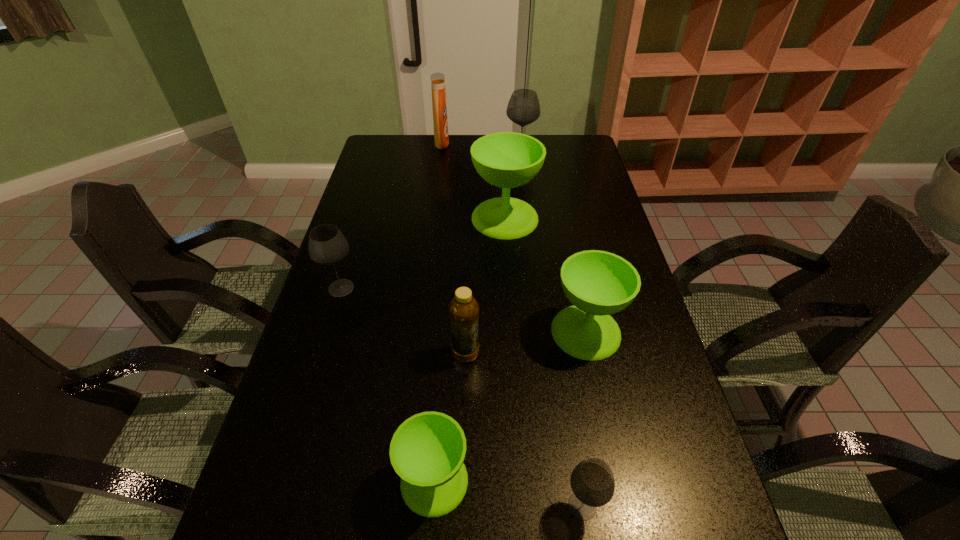
Image resolution: width=960 pixels, height=540 pixels. Find the location of `the nearest gray wineglass`. the nearest gray wineglass is located at coordinates (592, 482).

Locate an element on the screen. This screenshot has height=540, width=960. the smallest green wineglass is located at coordinates (427, 451).

Find the location of a particular element. The height and width of the screenshot is (540, 960). vacant space located on the front-facing side of the detergent is located at coordinates (461, 144).

You are a GUI agent. You are given a task and a screenshot of the screen. Output one action in this format:
    pyautogui.click(x=<x>, y=<y>)
    Task: Click on the free spot located 0.350m on the left of the farthest wineglass
    The height and width of the screenshot is (540, 960).
    Given the screenshot: What is the action you would take?
    pyautogui.click(x=418, y=156)

The height and width of the screenshot is (540, 960). In order to click on vacant position located on the left of the fifth nearest wineglass in this screenshot , I will do `click(395, 218)`.

This screenshot has width=960, height=540. Find the location of `vacant space located on the right of the bottle`. vacant space located on the right of the bottle is located at coordinates [584, 354].

At what (x,y) coordinates should I click in order to perform the action: click on vacant position located 0.370m on the front of the third nearest wineglass. Please return your answer as a coordinate pair (x, y). Image resolution: width=960 pixels, height=540 pixels. Looking at the image, I should click on (627, 526).

I want to click on blank space located 0.400m on the right of the leftmost object, so click(x=499, y=288).

The image size is (960, 540). What are the coordinates of `vacant space located on the back of the nearest gray wineglass` in the screenshot? It's located at (564, 388).

Image resolution: width=960 pixels, height=540 pixels. I want to click on vacant point located 0.400m on the back of the smallest green wineglass, so click(446, 306).